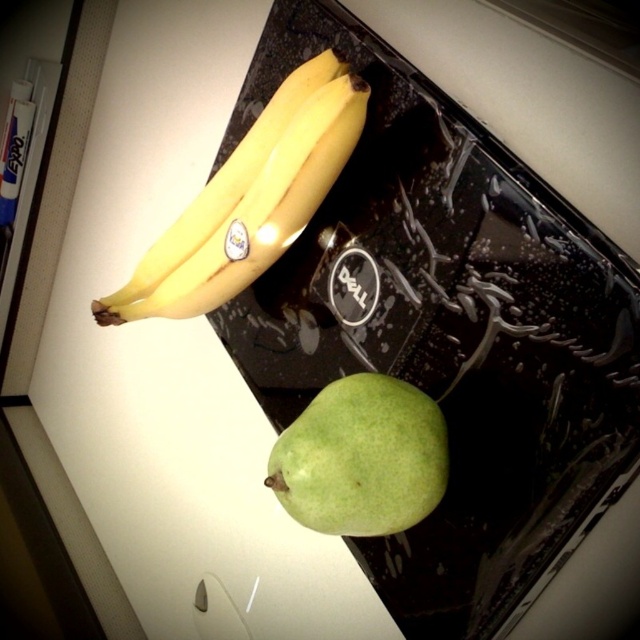
Question: Where is yellow matte banana at upper left located in relation to green matte pear at lower center in the image?

Choices:
 (A) left
 (B) right

Answer: (A)

Question: Can you confirm if yellow matte banana at upper left is positioned above green matte pear at lower center?

Choices:
 (A) no
 (B) yes

Answer: (B)

Question: Can you confirm if yellow matte banana at upper left is positioned below green matte pear at lower center?

Choices:
 (A) yes
 (B) no

Answer: (B)